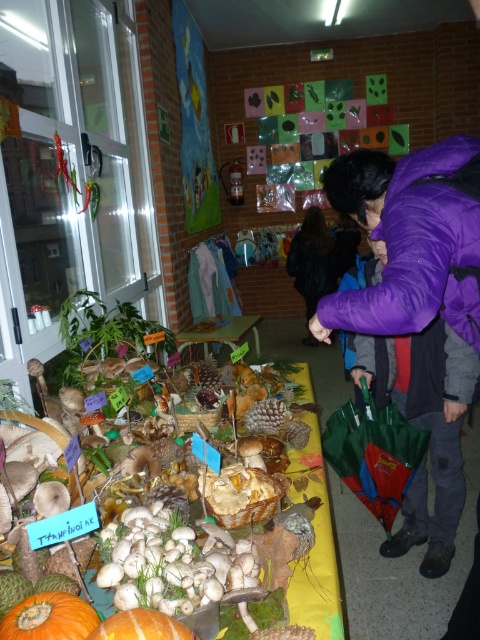
Which is behind, point (25, 417) or point (32, 620)?

The point (25, 417) is behind.

Can you confirm if white matte mushrooms at center is positioned below orange matte pumpkin at lower left?

No, white matte mushrooms at center is not below orange matte pumpkin at lower left.

Identify the location of white matte mushrooms at center. (314, 547).

Consider the image. Between purple fleece jacket at upper right and green leafy vegetable at left, which one appears on the left side from the viewer's perspective?

Positioned to the left is green leafy vegetable at left.

Measure the distance between purple fleece jacket at upper right and green leafy vegetable at left.

5.34 feet

This screenshot has height=640, width=480. I want to click on purple fleece jacket at upper right, so click(416, 310).

Does purple fleece jacket at upper right come behind wooden table at center?

No.

Is point (326, 182) in front of point (206, 349)?

Yes, it is in front of point (206, 349).

This screenshot has height=640, width=480. I want to click on purple fleece jacket at upper right, so click(416, 310).